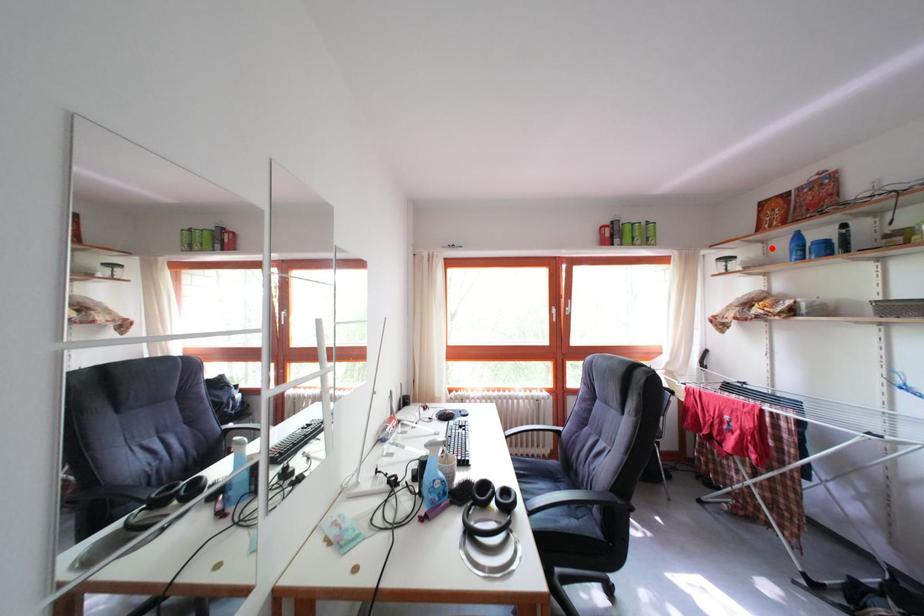
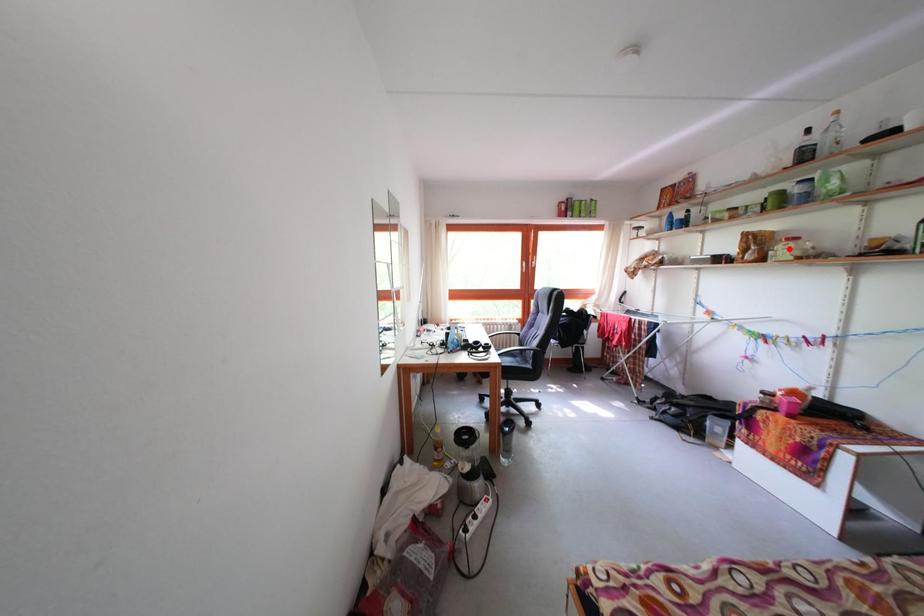
I am providing you with two images of the same scene from different viewpoints. A red point is marked on the first image and another point is marked on the second image. Are the points marked in image1 and image2 representing the same 3D position?

No